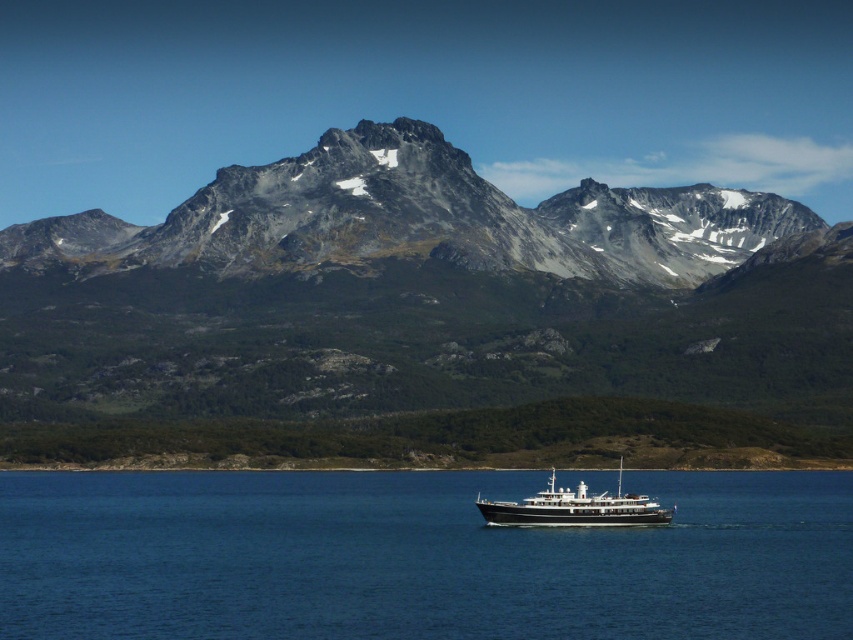
Does blue water at center come behind black polished wood boat at center?

That is False.

Can you confirm if blue water at center is positioned below black polished wood boat at center?

Correct, blue water at center is located below black polished wood boat at center.

Between point (776, 524) and point (553, 509), which one is positioned behind?

The point (776, 524) is more distant.

Identify the location of blue water at center. (416, 557).

Can you confirm if gray rocky mountain range at center is positioned to the left of blue water at center?

Correct, you'll find gray rocky mountain range at center to the left of blue water at center.

Describe the element at coordinates (425, 321) in the screenshot. I see `gray rocky mountain range at center` at that location.

Where is `gray rocky mountain range at center`? Image resolution: width=853 pixels, height=640 pixels. gray rocky mountain range at center is located at coordinates (425, 321).

Who is positioned more to the right, gray rocky mountain range at center or black polished wood boat at center?

black polished wood boat at center

Is gray rocky mountain range at center behind black polished wood boat at center?

No, it is not.

Describe the element at coordinates (425, 321) in the screenshot. I see `gray rocky mountain range at center` at that location.

This screenshot has width=853, height=640. I want to click on gray rocky mountain range at center, so click(425, 321).